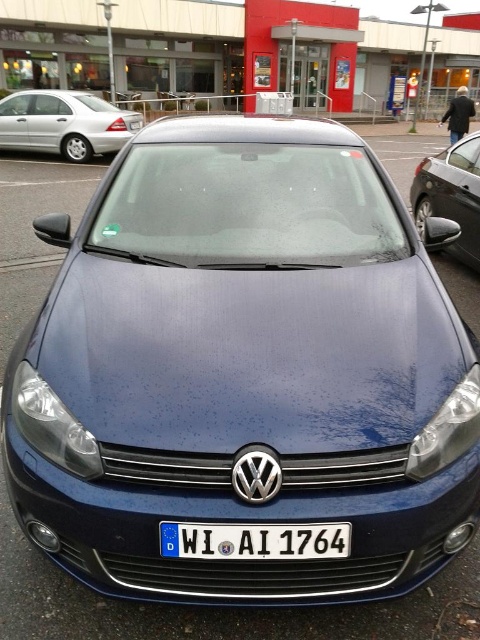
You are a parking attendant who needs to fit a new car into the parking spot between the silver metallic sedan at left and the satin black car at right. The new car is 1.8 meters wide. Can you determine if there is enough space between the two cars for the new car to park?

The silver metallic sedan at left is wider than the satin black car at right. However, the total space between them depends on their combined widths and positioning. Since the exact distance isn

You are a parking attendant checking the license plates of cars in the parking lot. You see the white plastic license plate at center and the satin black car at right. Which object is nearer to you?

The white plastic license plate at center is closer to the viewer than the satin black car at right.

You are a parking attendant who needs to fit a new car that requires a space taller than 1.8 meters. Looking at the silver metallic sedan at left and the satin black car at right, which one has a parking spot that can accommodate the new car?

The silver metallic sedan at left is much taller as satin black car at right, so its parking spot is taller and can accommodate the new car needing over 1.8 meters.